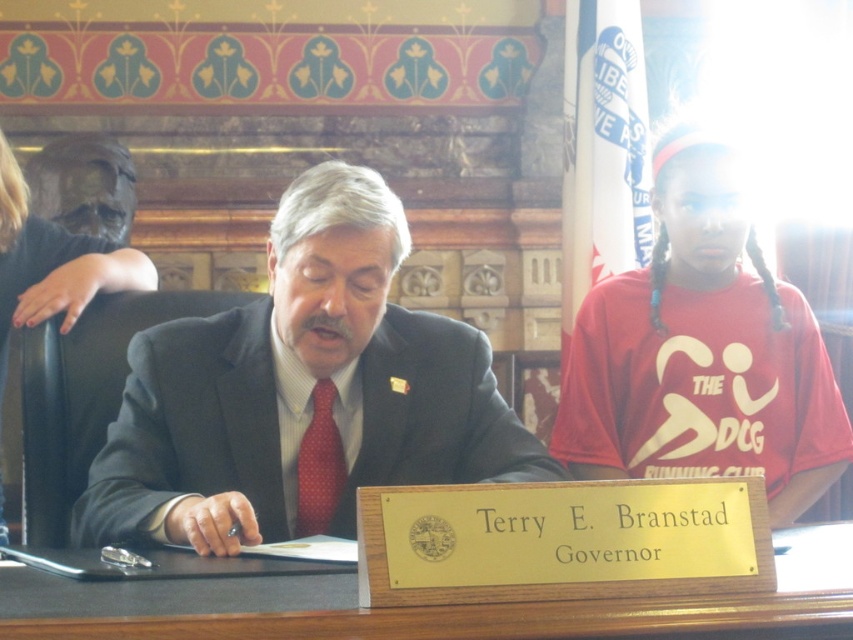
You are observing a formal meeting in a government building. You see a dark gray suit at center and a red dotted tie at center. Which object is positioned to the right of the other?

The dark gray suit at center is to the right of the red dotted tie at center.

In the scene shown: You are an observer in the room where the governor is speaking. You notice the dark gray suit at center and the red dotted tie at center. Which object is positioned higher up in the image?

The dark gray suit at center is located above the red dotted tie at center, so the dark gray suit at center is positioned higher up in the image.

You are standing in the room where the governor is seated. You want to take a photo of the point at coordinate point (801,609) without moving any objects. Is the distance sufficient for a clear photo?

The distance of point (801,609) from camera is 6.04 meters, so yes, the distance is sufficient for a clear photo.